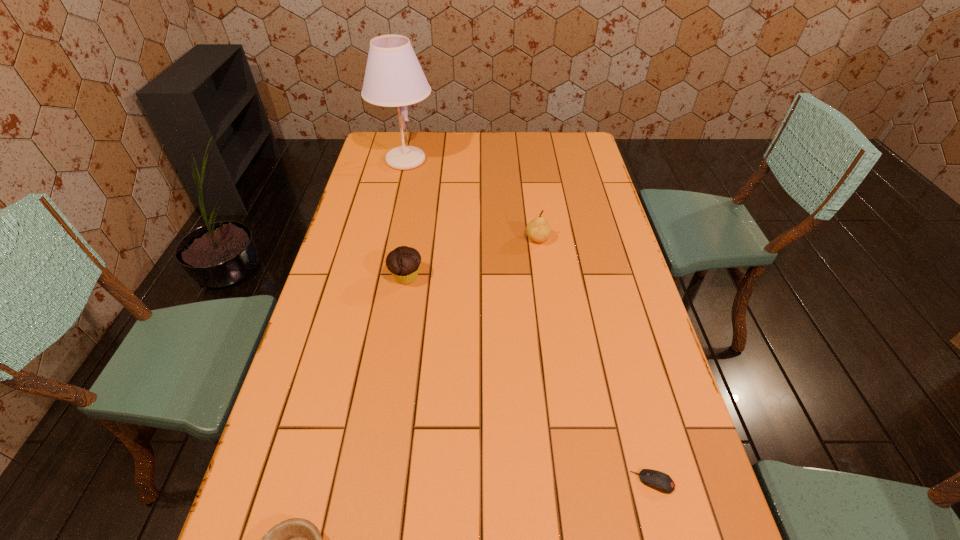
In order to click on free spot between the third farthest object and the lampshade in this screenshot , I will do `click(406, 219)`.

The width and height of the screenshot is (960, 540). I want to click on vacant area that lies between the farthest object and the fourth farthest object, so click(x=529, y=321).

This screenshot has height=540, width=960. I want to click on free space between the second farthest object and the muffin, so click(x=472, y=258).

Find the location of a particular element. Image resolution: width=960 pixels, height=540 pixels. vacant area between the rightmost object and the tallest object is located at coordinates click(529, 321).

I want to click on free spot between the rightmost object and the farthest object, so click(529, 321).

At what (x,y) coordinates should I click in order to perform the action: click on object that is the second nearest to the computer mouse. Please return your answer as a coordinate pair (x, y). The height and width of the screenshot is (540, 960). Looking at the image, I should click on (538, 230).

The width and height of the screenshot is (960, 540). I want to click on object that ranks as the fourth closest to the second nearest object, so tap(393, 77).